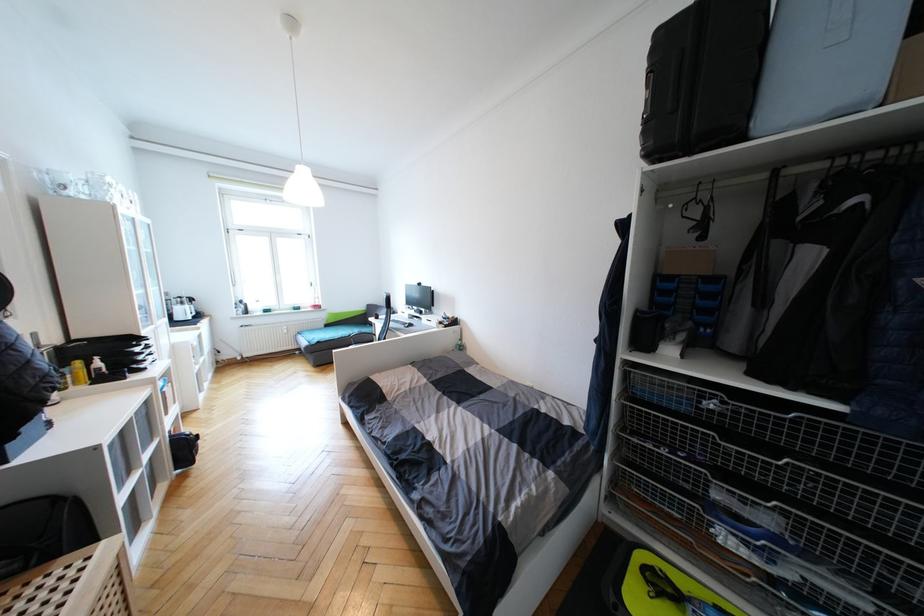
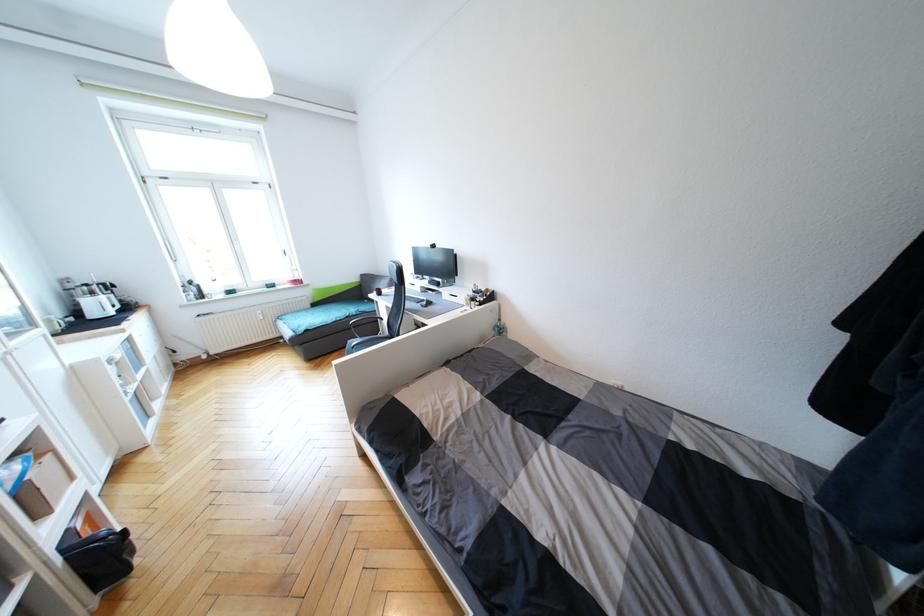
Find the pixel in the second image that matches pixel 201 317 in the first image.

(130, 309)